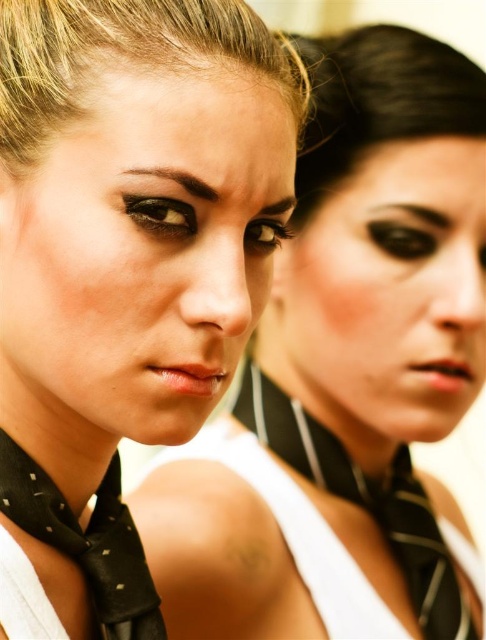
Is matte black scarf at left positioned before black striped tie at center?

Yes, it is.

Does matte black scarf at left appear on the right side of black striped tie at center?

In fact, matte black scarf at left is to the left of black striped tie at center.

This screenshot has width=486, height=640. What do you see at coordinates (347, 376) in the screenshot? I see `matte black scarf at left` at bounding box center [347, 376].

At what (x,y) coordinates should I click in order to perform the action: click on matte black scarf at left. Please return your answer as a coordinate pair (x, y). Looking at the image, I should click on (347, 376).

Is matte black scarf at center below matte black scarf at left?

Yes.

Locate an element on the screen. The height and width of the screenshot is (640, 486). matte black scarf at center is located at coordinates (123, 273).

Between point (472, 188) and point (122, 568), which one is positioned in front?

Point (122, 568) is more forward.

Who is lower down, matte black scarf at left or black dotted silk tie at lower left?

black dotted silk tie at lower left

Which is behind, point (356, 230) or point (132, 560)?

Point (356, 230)

Identify the location of matte black scarf at left. This screenshot has width=486, height=640. (347, 376).